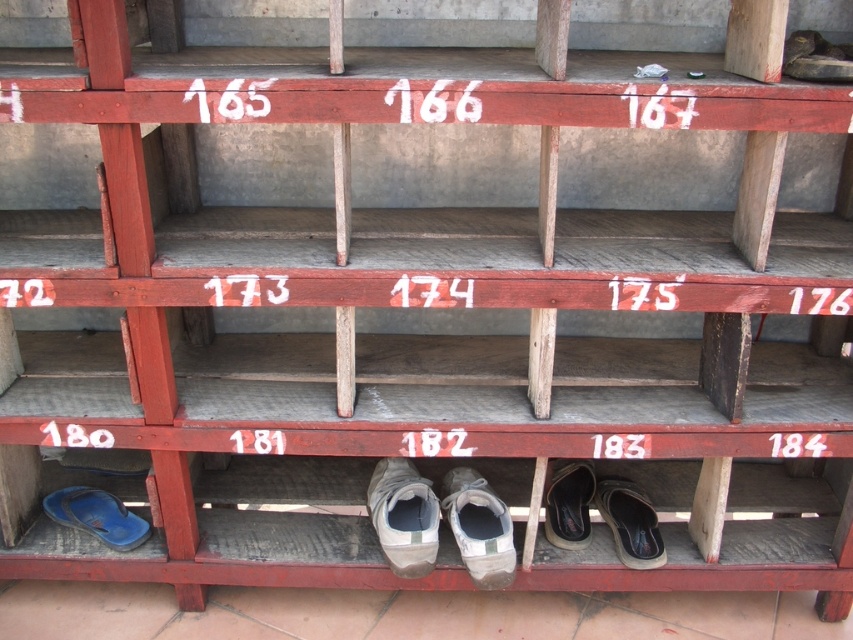
Question: From the image, what is the correct spatial relationship of leather brown shoe at lower right in relation to blue rubber flip-flop at lower left?

Choices:
 (A) right
 (B) left

Answer: (A)

Question: Which object is farther from the camera taking this photo?

Choices:
 (A) leather brown shoe at lower right
 (B) white fabric shoe at center

Answer: (A)

Question: Which point is farther to the camera?

Choices:
 (A) (395, 563)
 (B) (44, 504)
 (C) (576, 524)

Answer: (B)

Question: Which point is closer to the camera taking this photo?

Choices:
 (A) pos(393,483)
 (B) pos(645,506)

Answer: (A)

Question: Does white fabric shoe at lower center appear over black leather shoe at lower center?

Choices:
 (A) no
 (B) yes

Answer: (B)

Question: Is white fabric shoe at center wider than blue rubber flip-flop at lower left?

Choices:
 (A) yes
 (B) no

Answer: (B)